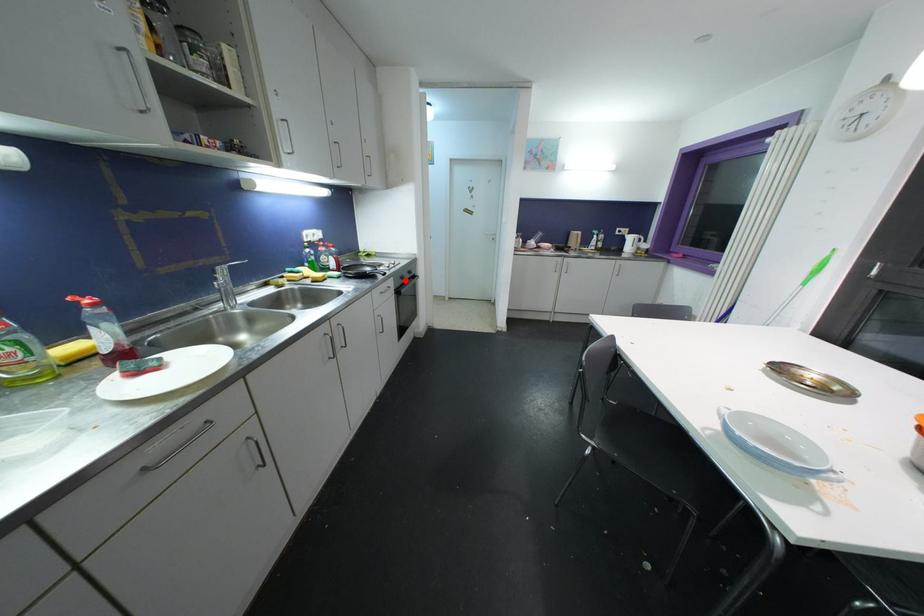
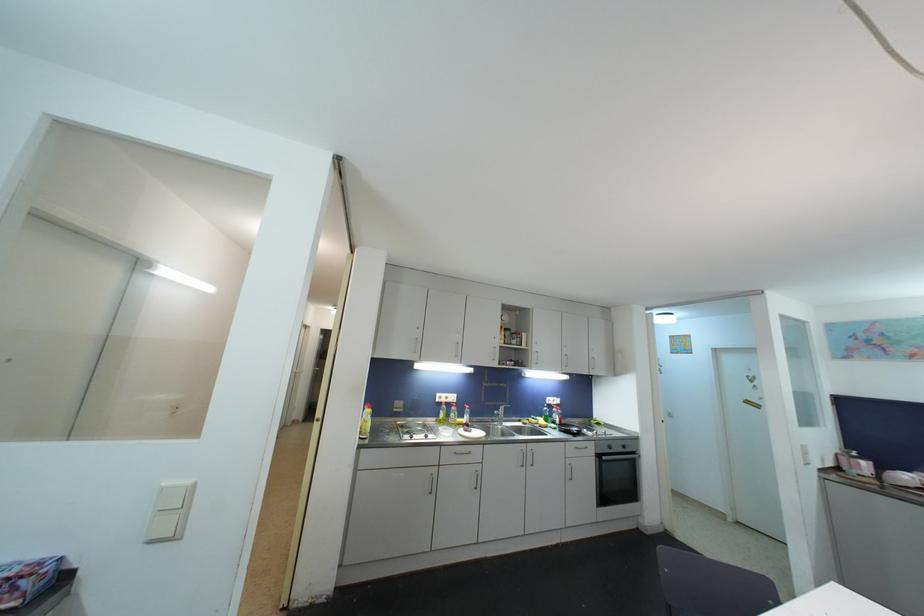
Find the pixel in the second image that matches the highlighted location in the first image.

(613, 450)